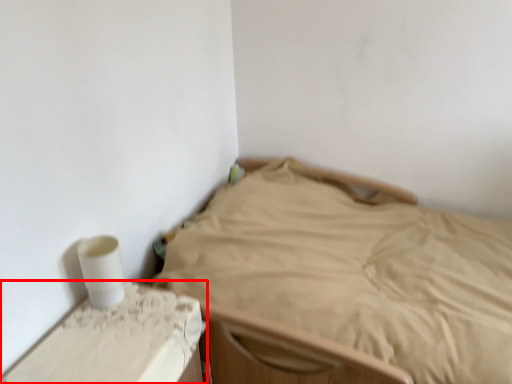
Question: From the image, what is the correct spatial relationship of furniture (annotated by the red box) in relation to bed?

Choices:
 (A) right
 (B) left

Answer: (B)